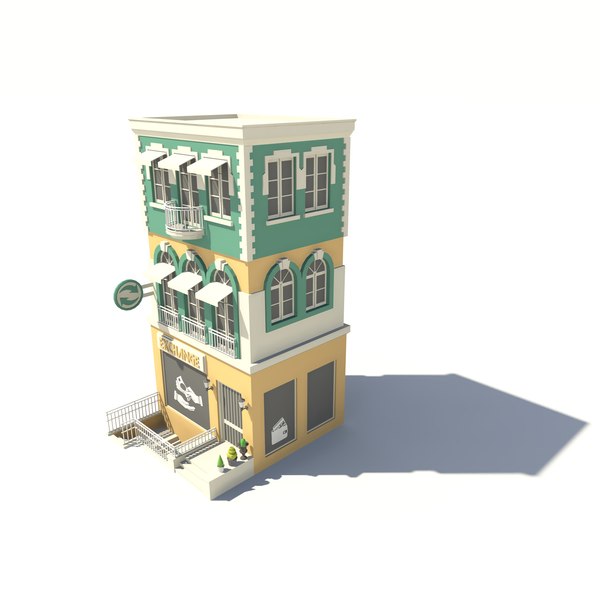
Where is `door`? door is located at coordinates 235,420.